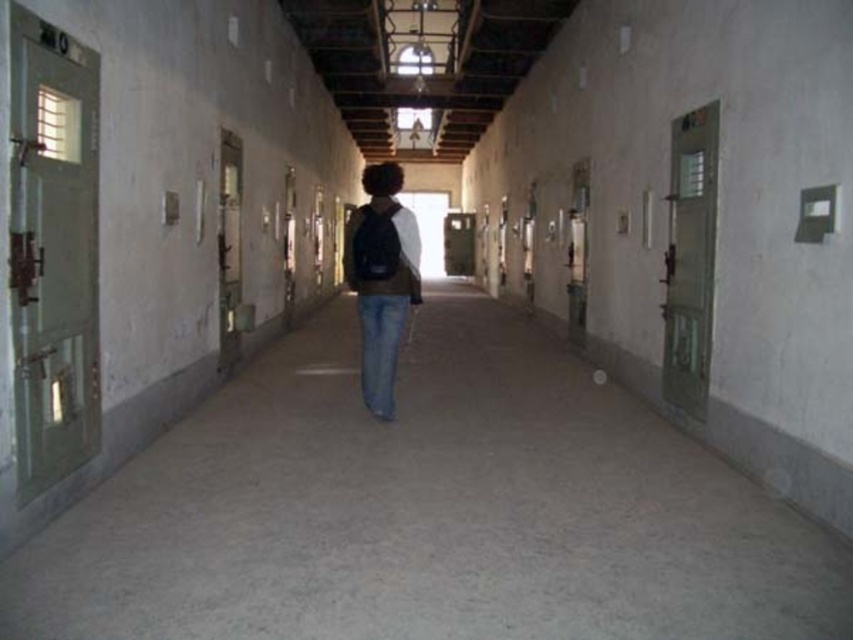
Which of these two, denim jeans at center or blue denim jeans at center, stands shorter?

Standing shorter between the two is blue denim jeans at center.

Does denim jeans at center appear under blue denim jeans at center?

Actually, denim jeans at center is above blue denim jeans at center.

The width and height of the screenshot is (853, 640). What do you see at coordinates (381, 278) in the screenshot? I see `denim jeans at center` at bounding box center [381, 278].

I want to click on denim jeans at center, so click(381, 278).